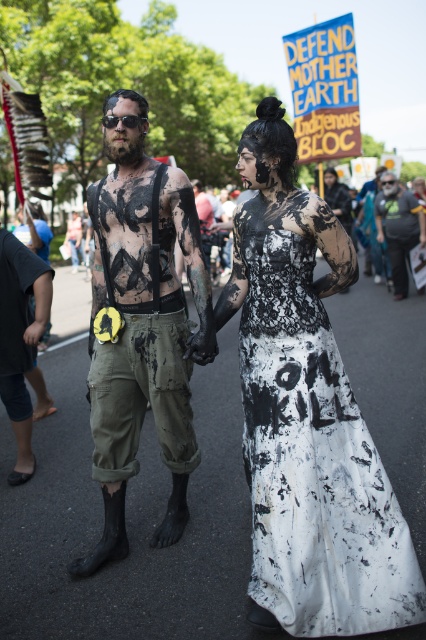
Is white lace dress at center positioned behind matte black body paint at center?

That is False.

This screenshot has width=426, height=640. Describe the element at coordinates (313, 456) in the screenshot. I see `white lace dress at center` at that location.

Does point (324, 545) come behind point (117, 472)?

No, (324, 545) is closer to viewer.

This screenshot has width=426, height=640. I want to click on white lace dress at center, so click(313, 456).

Is point (267, 538) less distant than point (342, 200)?

That is True.

Can you confirm if white lace dress at center is bigger than black matte dress at center?

Incorrect, white lace dress at center is not larger than black matte dress at center.

Find the location of a particular element. This screenshot has width=426, height=640. white lace dress at center is located at coordinates (313, 456).

This screenshot has height=640, width=426. Find the location of `white lace dress at center`. white lace dress at center is located at coordinates (313, 456).

From the picture: Can you confirm if matte black body paint at center is positioned to the left of white fabric shirt at right?

Correct, you'll find matte black body paint at center to the left of white fabric shirt at right.

Can you confirm if matte black body paint at center is positioned below white fabric shirt at right?

Yes.

Which is in front, point (120, 173) or point (391, 173)?

Point (120, 173)

This screenshot has width=426, height=640. Find the location of `matte black body paint at center`. matte black body paint at center is located at coordinates (141, 324).